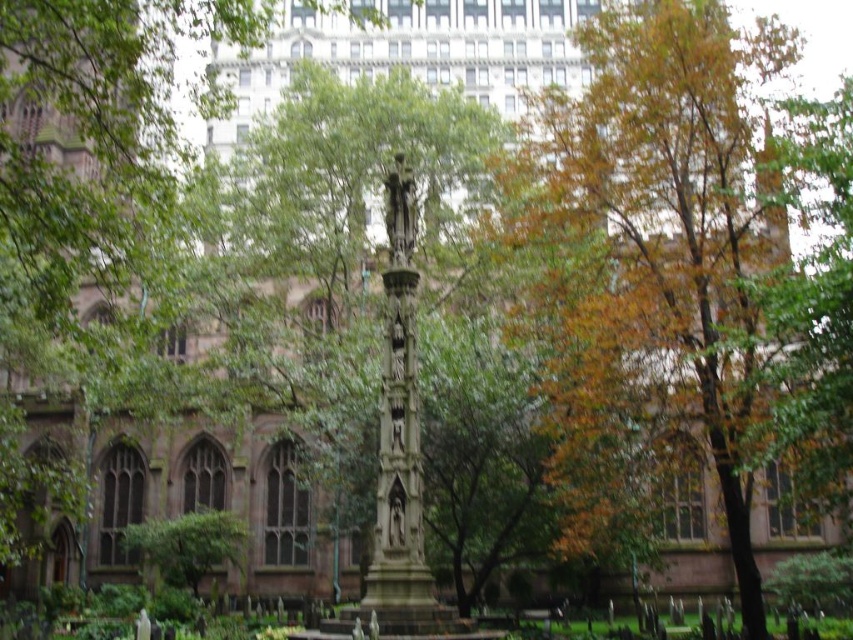
Question: Considering the relative positions of autumn leaves at center and green leafy tree at lower left in the image provided, where is autumn leaves at center located with respect to green leafy tree at lower left?

Choices:
 (A) right
 (B) left

Answer: (A)

Question: Which point is farther to the camera?

Choices:
 (A) green leafy tree at lower left
 (B) autumn leaves at center

Answer: (A)

Question: Which point is closer to the camera taking this photo?

Choices:
 (A) (132, 548)
 (B) (596, 461)

Answer: (B)

Question: Considering the relative positions of autumn leaves at center and green leafy tree at lower left in the image provided, where is autumn leaves at center located with respect to green leafy tree at lower left?

Choices:
 (A) left
 (B) right

Answer: (B)

Question: Is autumn leaves at center positioned behind green leafy tree at lower left?

Choices:
 (A) no
 (B) yes

Answer: (A)